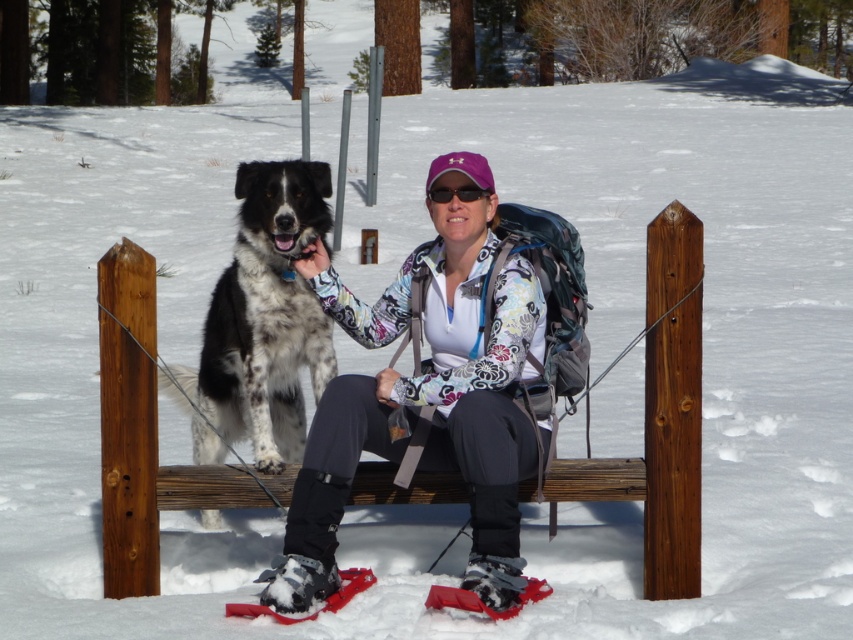
In the scene shown: Measure the distance between point (653, 596) and camera.

Point (653, 596) is 6.33 meters away from camera.

What do you see at coordinates (660, 417) in the screenshot? The image size is (853, 640). I see `wooden bench at center` at bounding box center [660, 417].

At what (x,y) coordinates should I click in order to perform the action: click on wooden bench at center. Please return your answer as a coordinate pair (x, y). Image resolution: width=853 pixels, height=640 pixels. Looking at the image, I should click on (660, 417).

Is point (285, 356) more distant than point (495, 561)?

Yes, point (285, 356) is behind point (495, 561).

From the picture: Is spotted fur dog at center taller than gray fabric ski boot at lower center?

Yes.

Is point (253, 272) positioned in front of point (503, 586)?

No, (253, 272) is behind (503, 586).

At what (x,y) coordinates should I click in order to perform the action: click on spotted fur dog at center. Please return your answer as a coordinate pair (x, y). Looking at the image, I should click on (262, 323).

Is floral-patterned jacket at center to the right of gray fabric ski boot at lower center from the viewer's perspective?

In fact, floral-patterned jacket at center is to the left of gray fabric ski boot at lower center.

Find the location of a particular element. This screenshot has height=640, width=853. floral-patterned jacket at center is located at coordinates (431, 381).